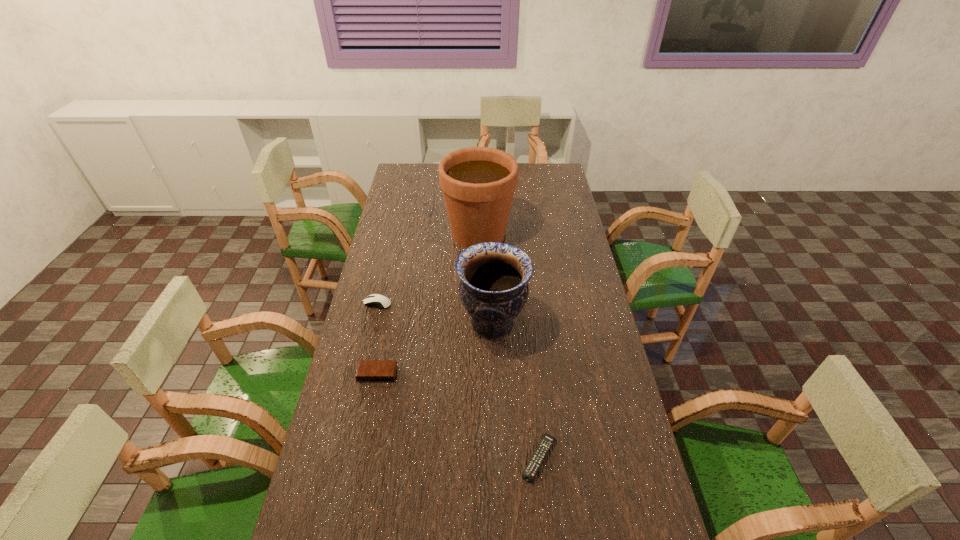
What are the coordinates of `free space between the pottery and the shortest object` in the screenshot? It's located at (516, 390).

This screenshot has height=540, width=960. I want to click on free space between the fourth tallest object and the remote control, so click(458, 416).

I want to click on empty space between the flowerpot and the remote control, so click(x=509, y=346).

What are the coordinates of `vacant area that lies between the nearest object and the second shortest object` in the screenshot? It's located at (458, 416).

Locate an element on the screen. The image size is (960, 540). empty space between the shortest object and the second shortest object is located at coordinates (458, 416).

Where is `vacant space that's between the third shortest object and the fourth farthest object`? vacant space that's between the third shortest object and the fourth farthest object is located at coordinates (377, 339).

Find the location of `free space that is in between the mouse and the tallest object`. free space that is in between the mouse and the tallest object is located at coordinates (428, 268).

I want to click on unoccupied position between the pottery and the mouse, so click(435, 313).

Locate which object is the third closest to the second shortest object. Please provide its 2D coordinates. Your answer should be formatted as a tuple, i.e. [(x, y)], where the tuple contains the x and y coordinates of a point satisfying the conditions above.

[(543, 448)]

Select which object is the fourth closest to the third tallest object. Please provide its 2D coordinates. Your answer should be formatted as a tuple, i.e. [(x, y)], where the tuple contains the x and y coordinates of a point satisfying the conditions above.

[(543, 448)]